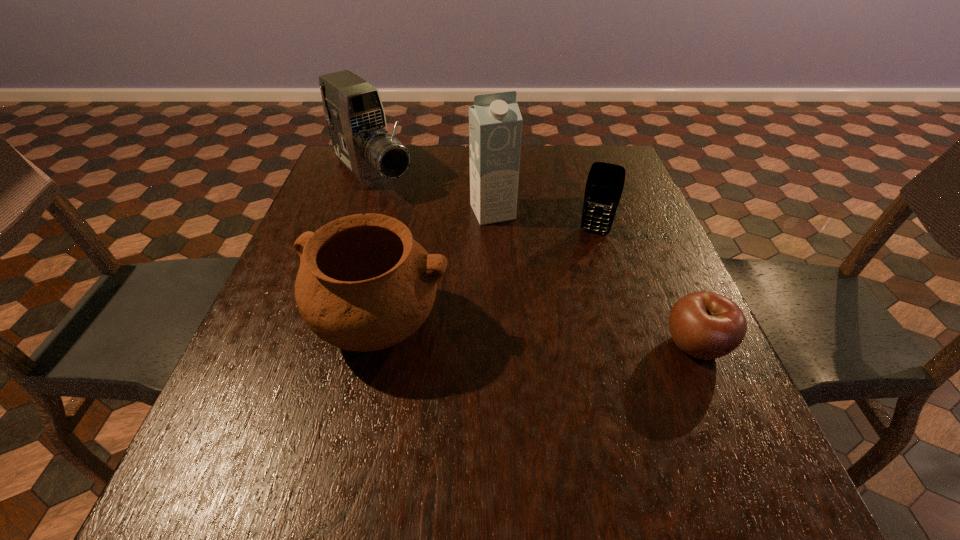
I want to click on apple situated at the right edge, so tap(706, 325).

What are the coordinates of `cellular telephone situated at the right edge` in the screenshot? It's located at (605, 182).

The height and width of the screenshot is (540, 960). I want to click on object that is at the far left corner, so click(353, 109).

In the image, there is a desktop. Where is `free space at the far edge`? free space at the far edge is located at coordinates (567, 178).

The height and width of the screenshot is (540, 960). In the image, there is a desktop. Find the location of `free space at the near edge`. free space at the near edge is located at coordinates (616, 395).

Identify the location of vacant space at the left edge of the desktop. (365, 202).

This screenshot has width=960, height=540. Identify the location of free region at the right edge of the desktop. (640, 261).

In the image, there is a desktop. At what (x,y) coordinates should I click in order to perform the action: click on vacant space at the far right corner. Please return your answer as a coordinate pair (x, y). The image size is (960, 540). Looking at the image, I should click on (604, 157).

Find the location of a particular element. This screenshot has height=540, width=960. empty space that is in between the cellular telephone and the apple is located at coordinates (645, 288).

I want to click on unoccupied area between the shortest object and the third object from left to right, so click(594, 278).